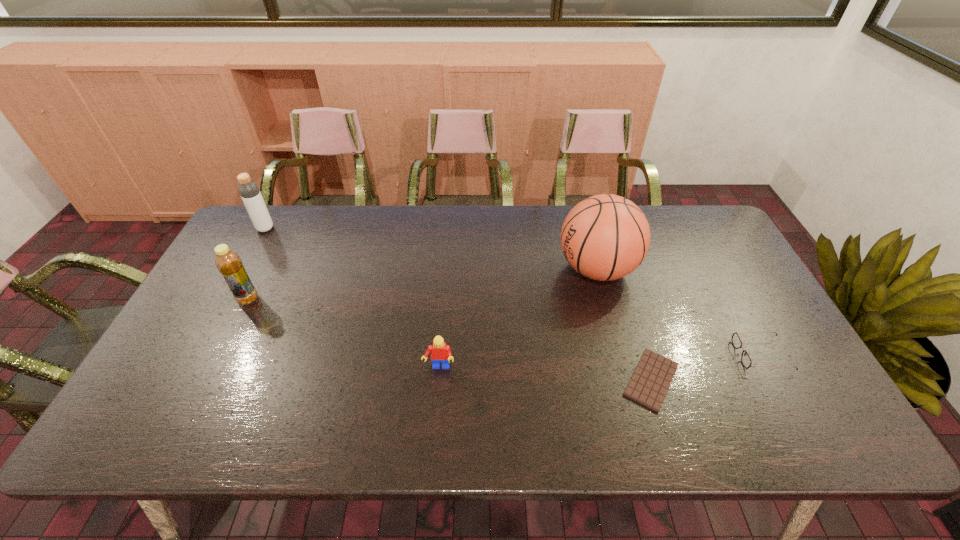
At what (x,y) coordinates should I click in order to perform the action: click on basketball. Please return your answer as a coordinate pair (x, y). Image resolution: width=960 pixels, height=540 pixels. Looking at the image, I should click on (605, 237).

Locate an element on the screen. The width and height of the screenshot is (960, 540). the farther bottle is located at coordinates (249, 191).

Locate an element on the screen. The height and width of the screenshot is (540, 960). the leftmost object is located at coordinates (249, 191).

The height and width of the screenshot is (540, 960). Find the location of `the fifth object from right to left`. the fifth object from right to left is located at coordinates (229, 264).

Locate an element on the screen. The width and height of the screenshot is (960, 540). the right bottle is located at coordinates (229, 264).

Identify the location of the fourth object from right to left. The width and height of the screenshot is (960, 540). (440, 352).

This screenshot has width=960, height=540. Find the location of `Lego`. Lego is located at coordinates (440, 352).

At what (x,y) coordinates should I click in order to perform the action: click on the rightmost object. Please return your answer as a coordinate pair (x, y). The width and height of the screenshot is (960, 540). Looking at the image, I should click on (736, 341).

You are a GUI agent. You are given a task and a screenshot of the screen. Output one action in this format:
    pyautogui.click(x=<x>, y=<y>)
    Task: Click on the sunglasses
    
    Given the screenshot: What is the action you would take?
    pyautogui.click(x=736, y=341)

Identify the location of the shortest object. (649, 384).